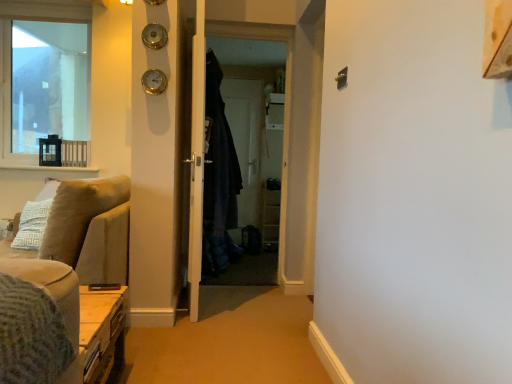
Question: Do you think dark blue fabric robe at center is within white wood shelving unit at center, or outside of it?

Choices:
 (A) inside
 (B) outside

Answer: (B)

Question: Is dark blue fabric robe at center in front of or behind white wood shelving unit at center in the image?

Choices:
 (A) behind
 (B) front

Answer: (B)

Question: Estimate the real-world distances between objects in this image. Which object is farther from the beige fabric couch at left?

Choices:
 (A) dark blue fabric robe at center
 (B) green knitted blanket at lower left
 (C) clear glass window at upper left
 (D) dark fabric screen door at center, which appears as the first screen door when viewed from the front
 (E) white wood door at center

Answer: (C)

Question: Which of these objects is positioned farthest from the dark blue fabric robe at center?

Choices:
 (A) dark fabric screen door at center, which is the 2th screen door from back to front
 (B) white wood shelving unit at center
 (C) clear glass window at upper left
 (D) white wood door at center
 (E) green knitted blanket at lower left

Answer: (C)